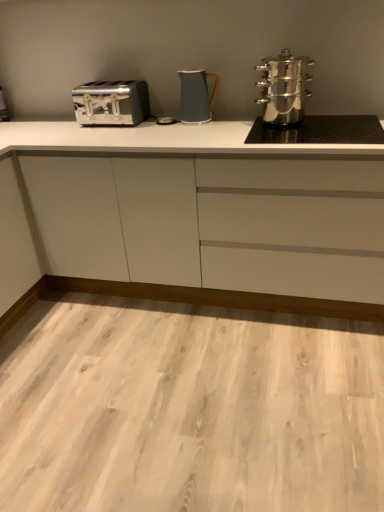
Where is `free space in front of matte blue pitcher at center, marked as the first kitchen appliance in a left-to-right arrangement`? This screenshot has height=512, width=384. free space in front of matte blue pitcher at center, marked as the first kitchen appliance in a left-to-right arrangement is located at coordinates (187, 132).